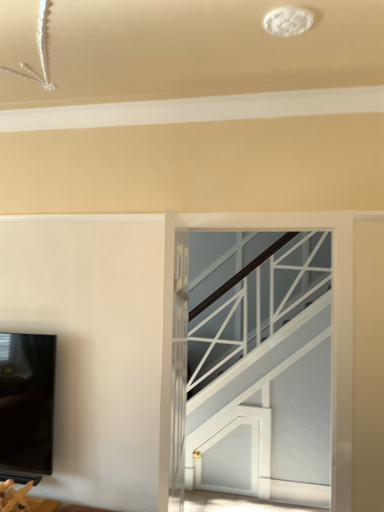
Question: Does point (299, 498) appear closer or farther from the camera than point (26, 484)?

Choices:
 (A) closer
 (B) farther

Answer: (B)

Question: Is clear glass door at center wider or thinner than matte gold figurine at lower left?

Choices:
 (A) wide
 (B) thin

Answer: (B)

Question: Choose the correct answer: Is clear glass door at center inside matte gold figurine at lower left or outside it?

Choices:
 (A) inside
 (B) outside

Answer: (B)

Question: Based on their positions, is matte gold figurine at lower left located to the left or right of clear glass door at center?

Choices:
 (A) left
 (B) right

Answer: (A)

Question: Considering the positions of matte gold figurine at lower left and clear glass door at center in the image, is matte gold figurine at lower left taller or shorter than clear glass door at center?

Choices:
 (A) tall
 (B) short

Answer: (B)

Question: From a real-world perspective, is matte gold figurine at lower left positioned above or below clear glass door at center?

Choices:
 (A) above
 (B) below

Answer: (B)

Question: Considering the positions of matte gold figurine at lower left and clear glass door at center in the image, is matte gold figurine at lower left wider or thinner than clear glass door at center?

Choices:
 (A) wide
 (B) thin

Answer: (A)